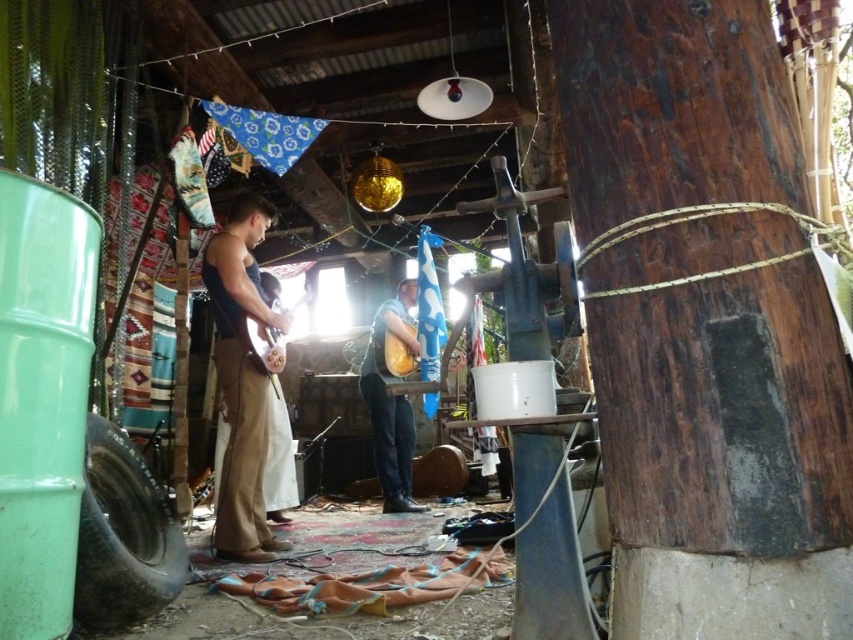
Between point (224, 362) and point (376, 396), which one is positioned behind?

Positioned behind is point (376, 396).

Can you confirm if brown suede guitar at center is smaller than matte brown guitar at center?

No.

The height and width of the screenshot is (640, 853). What do you see at coordinates (241, 380) in the screenshot?
I see `brown suede guitar at center` at bounding box center [241, 380].

I want to click on brown suede guitar at center, so click(241, 380).